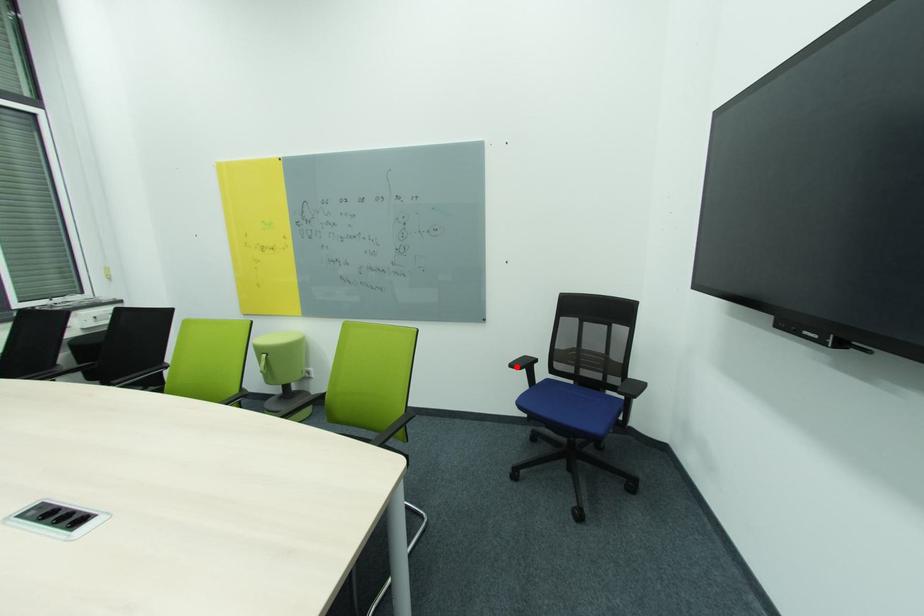
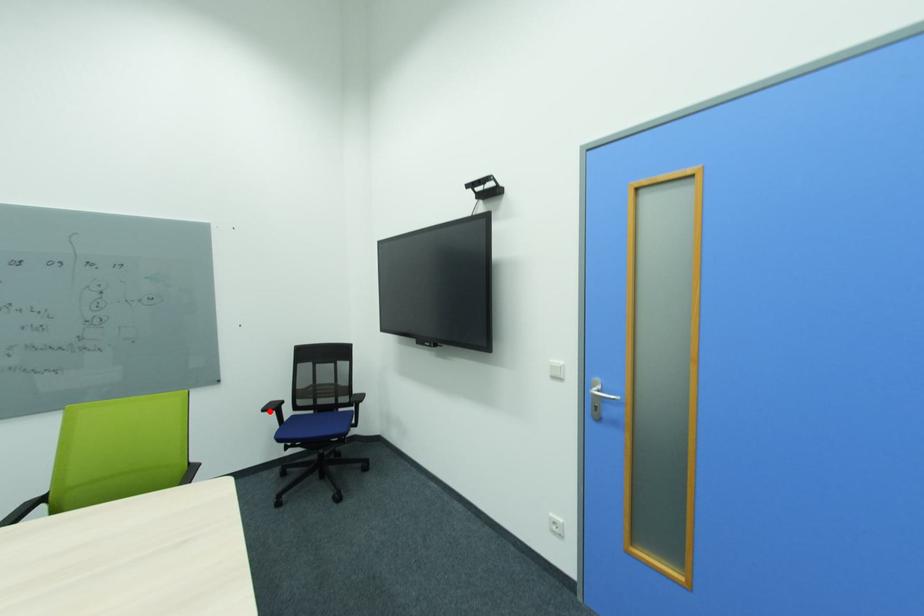
I am providing you with two images of the same scene from different viewpoints. A red point is marked on the first image and another point is marked on the second image. Is the red point in image1 aligned with the point shown in image2?

Yes